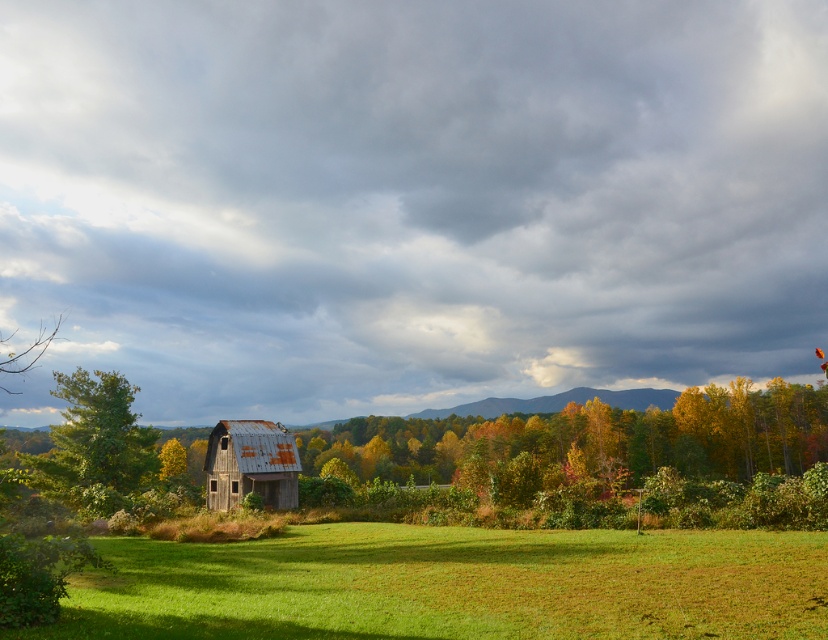
Does cloudy sky at upper center appear under yellow-green foliage at lower left?

No.

You are a GUI agent. You are given a task and a screenshot of the screen. Output one action in this format:
    pyautogui.click(x=<x>, y=<y>)
    Task: Click on the cloudy sky at upper center
    Image resolution: width=828 pixels, height=640 pixels.
    Given the screenshot: What is the action you would take?
    pyautogui.click(x=410, y=198)

Identify the location of cloudy sky at upper center. This screenshot has height=640, width=828. (410, 198).

Does rusty metal barn at center appear on the left side of yellow-green foliage at lower left?

Incorrect, rusty metal barn at center is not on the left side of yellow-green foliage at lower left.

Does rusty metal barn at center have a lesser height compared to yellow-green foliage at lower left?

Indeed, rusty metal barn at center has a lesser height compared to yellow-green foliage at lower left.

The width and height of the screenshot is (828, 640). Describe the element at coordinates (249, 464) in the screenshot. I see `rusty metal barn at center` at that location.

Where is `rusty metal barn at center`? The width and height of the screenshot is (828, 640). rusty metal barn at center is located at coordinates (249, 464).

Which of these two, cloudy sky at upper center or rusty metal barn at center, stands shorter?

rusty metal barn at center is shorter.

Is cloudy sky at upper center positioned at the back of rusty metal barn at center?

Yes, cloudy sky at upper center is behind rusty metal barn at center.

Is point (588, 70) behind point (243, 429)?

Yes, it is.

Image resolution: width=828 pixels, height=640 pixels. In order to click on cloudy sky at upper center in this screenshot , I will do `click(410, 198)`.